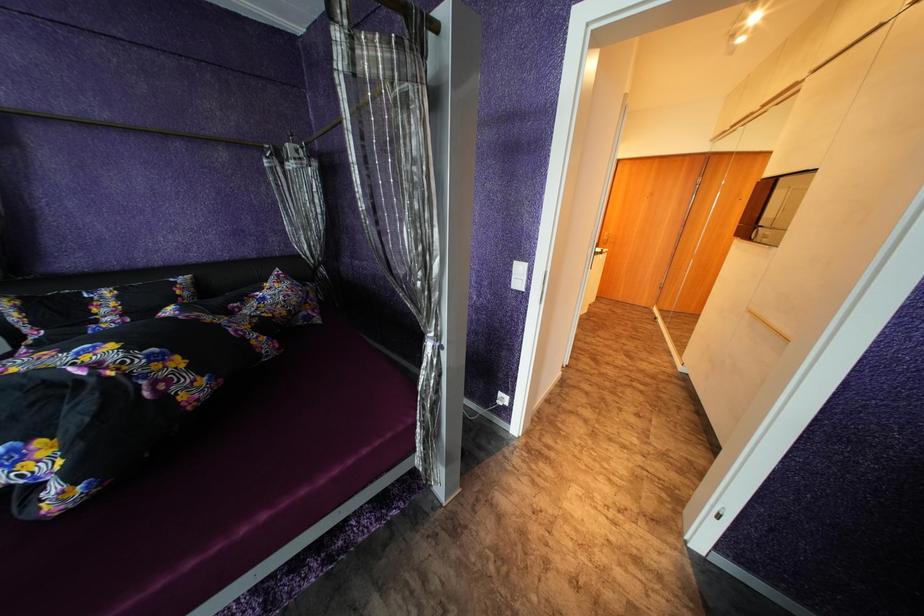
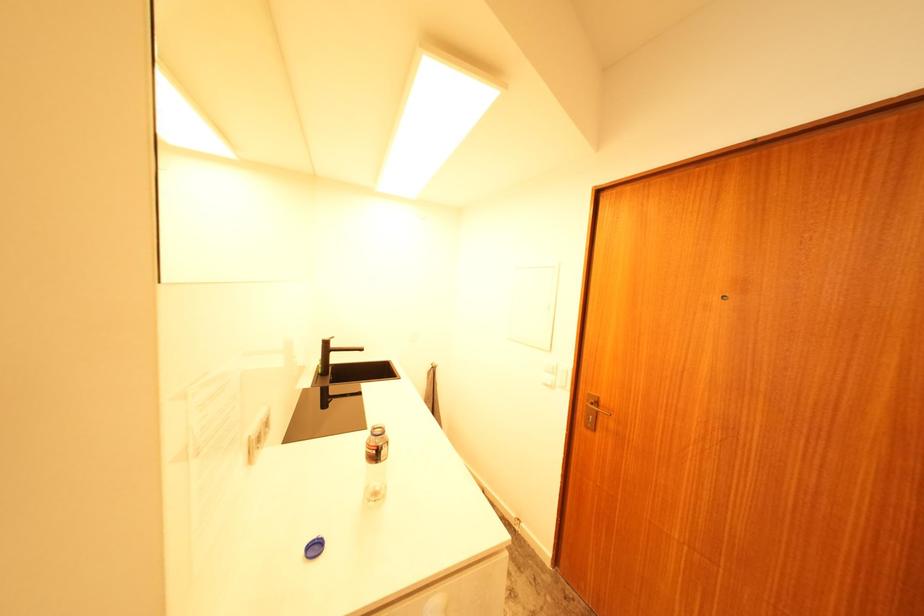
Which direction would the cameraman need to move to produce the second image?

The movement direction of the cameraman is right, forward.